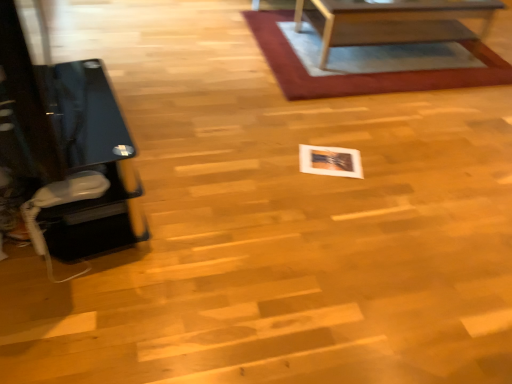
The height and width of the screenshot is (384, 512). What are the coordinates of `vacant area that lies between black glass table at left and white glossy photo frame at center` in the screenshot? It's located at (218, 183).